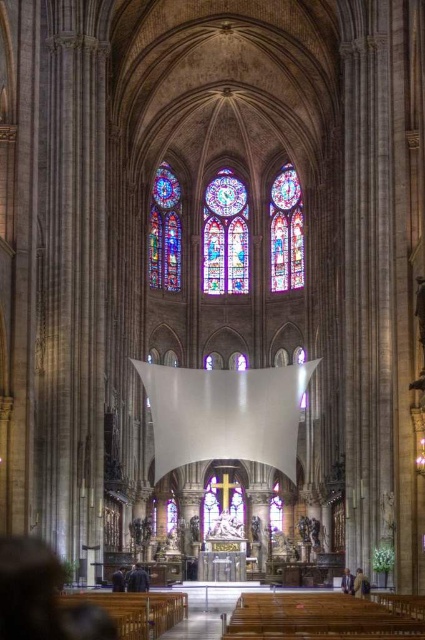
You are standing at the entrance of the cathedral and want to locate the stained glass window at upper center. According to the coordinates provided, where should you look relative to your position?

The stained glass window at upper center is located at coordinates 0.362 on the x axis and 0.673 on the y axis, so you should look slightly to the left and upwards from your position at the entrance.

You are standing at the entrance of the cathedral and want to locate the stained glass window at center. Based on its 2D coordinates, which direction should you face to see it?

The stained glass window at center is located at coordinates point (x=224, y=236), so you should face towards the center area of the cathedral to see it.

In the scene shown: You are an architect visiting the cathedral and want to compare the stained glass window at upper center and the multicolored stained glass at center. Which one is taller?

The multicolored stained glass at center is taller than the stained glass window at upper center.